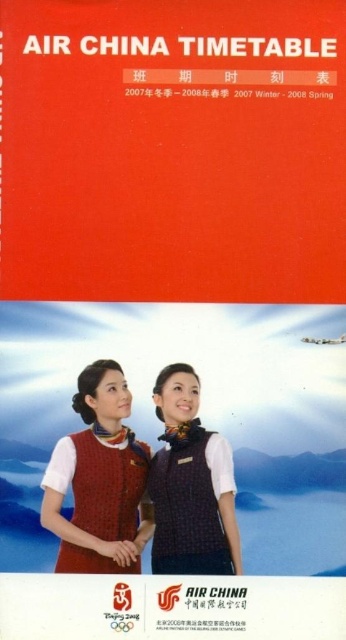
What is the exact location of the knitted sweater at center on the cover?

The knitted sweater at center is located at point (98, 480) on the cover.

You are standing 3 meters away from the cover of the Air China timetable. A point marked at coordinates point (74, 522) is part of the image. Is this point closer to you or farther away than your current distance?

The point (74, 522) is 2.80 meters away from the viewer. Since you are standing 3 meters away, the point is slightly closer to you than your current distance.